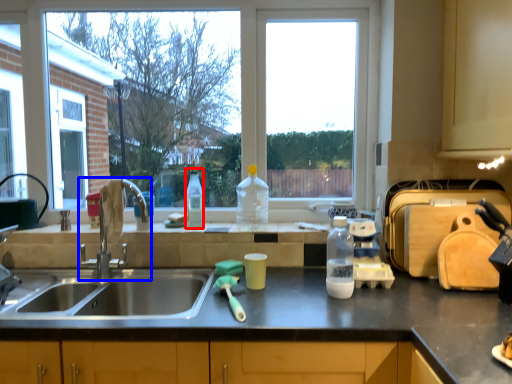
Question: Which of the following is the closest to the observer, bottle (highlighted by a red box) or tap (highlighted by a blue box)?

Choices:
 (A) bottle
 (B) tap

Answer: (B)